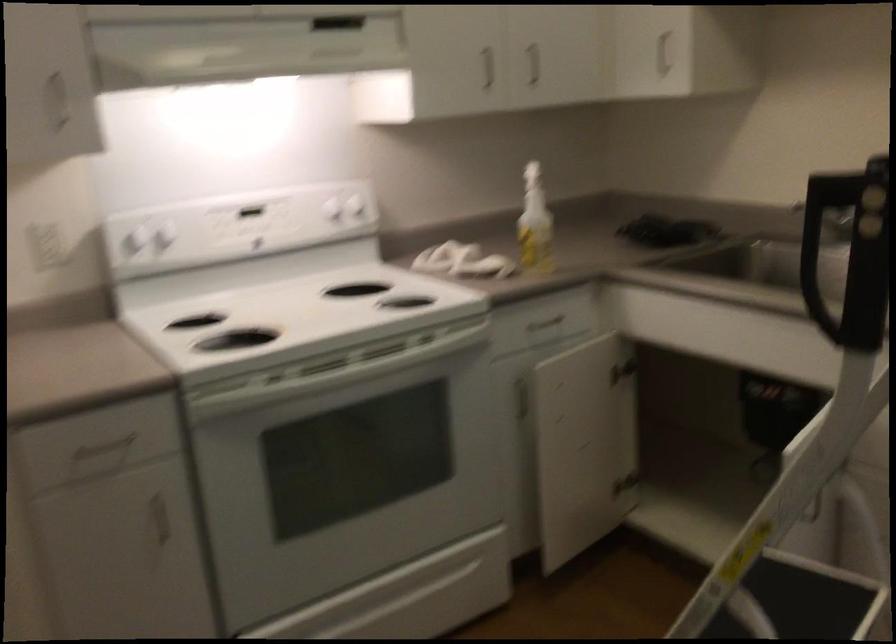
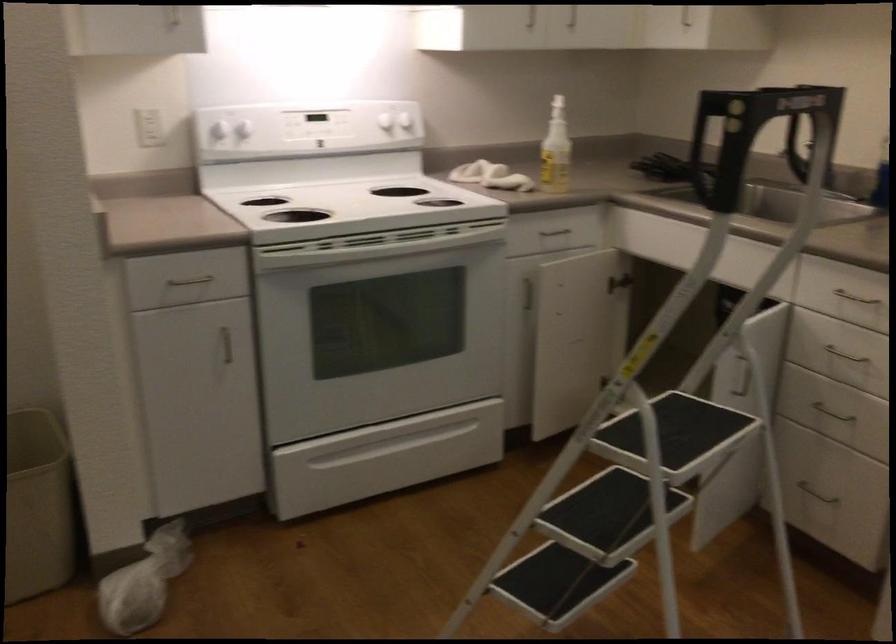
Find the pixel in the second image that matches the point at 489,80 in the first image.

(532, 19)